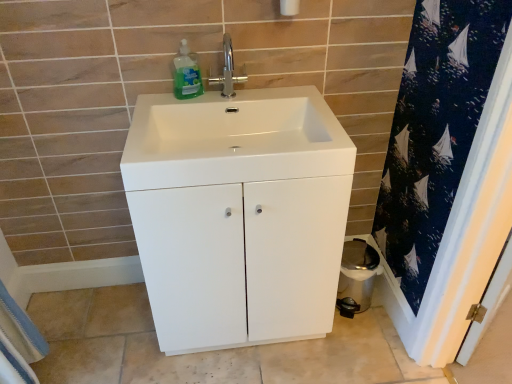
Where is `free point to the right of white cotton bath towel at lower left`? Image resolution: width=512 pixels, height=384 pixels. free point to the right of white cotton bath towel at lower left is located at coordinates (83, 324).